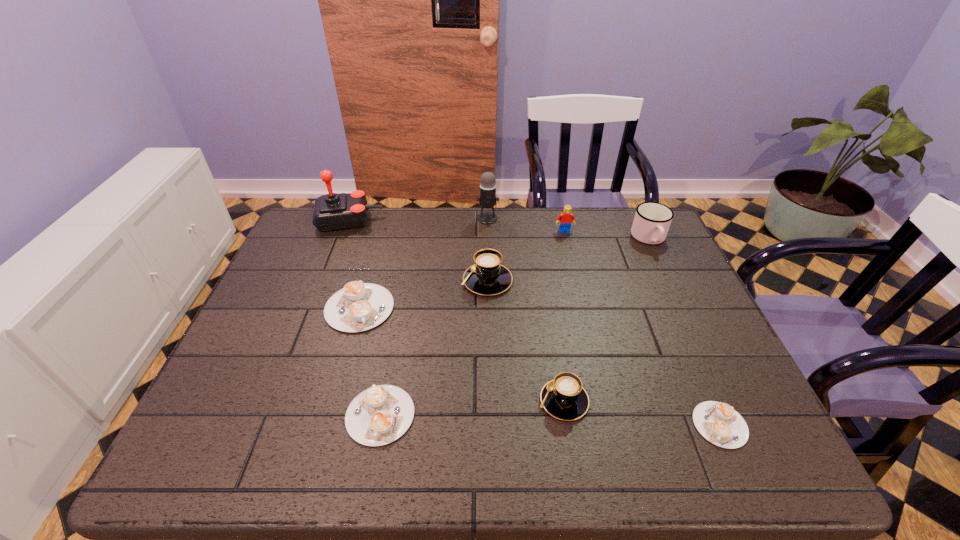
Where is `vacant space situated on the back of the sixth tallest object`? The width and height of the screenshot is (960, 540). vacant space situated on the back of the sixth tallest object is located at coordinates (546, 294).

Image resolution: width=960 pixels, height=540 pixels. Identify the location of free space located on the back of the seventh tallest object. (372, 266).

Locate an element on the screen. This screenshot has height=540, width=960. vacant space located on the left of the second shortest cappuccino is located at coordinates (219, 415).

Identify the location of free location located 0.340m on the back of the rightmost white cappuccino. The width and height of the screenshot is (960, 540). (662, 293).

The width and height of the screenshot is (960, 540). I want to click on joystick located in the far edge section of the desktop, so click(333, 211).

I want to click on microphone present at the far edge, so click(x=487, y=199).

I want to click on Lego positioned at the far edge, so click(x=566, y=218).

Find the location of `mug that is at the far edge`. mug that is at the far edge is located at coordinates (652, 220).

This screenshot has height=540, width=960. I want to click on object at the left edge, so pyautogui.click(x=333, y=211).

Where is `mug that is at the right edge`? mug that is at the right edge is located at coordinates (652, 220).